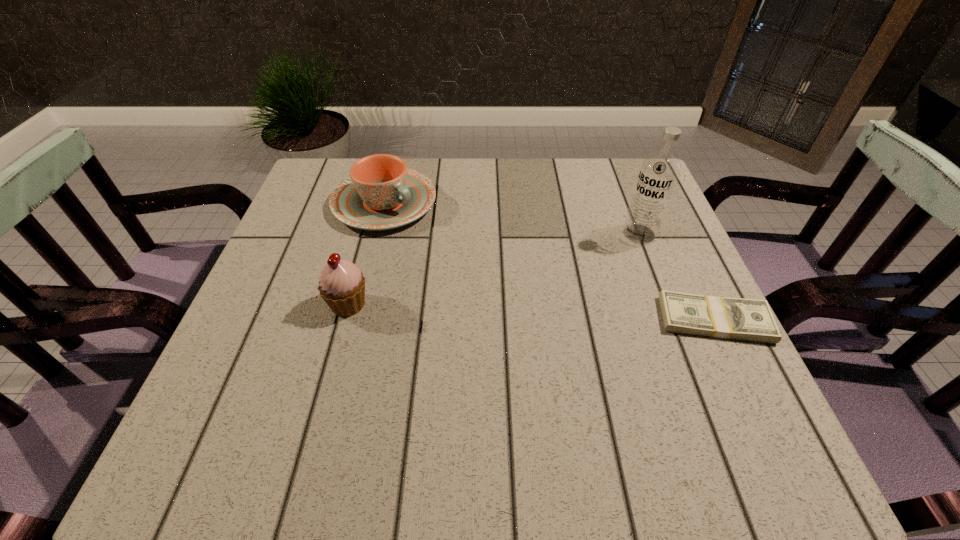
Where is `vacant space on the desktop that is between the third shortest object and the dollar and is positioned on the handle side of the second shortest object`? vacant space on the desktop that is between the third shortest object and the dollar and is positioned on the handle side of the second shortest object is located at coordinates (559, 313).

I want to click on free spot on the desktop that is between the third shortest object and the shortest object and is positioned on the front label of the tallest object, so click(511, 311).